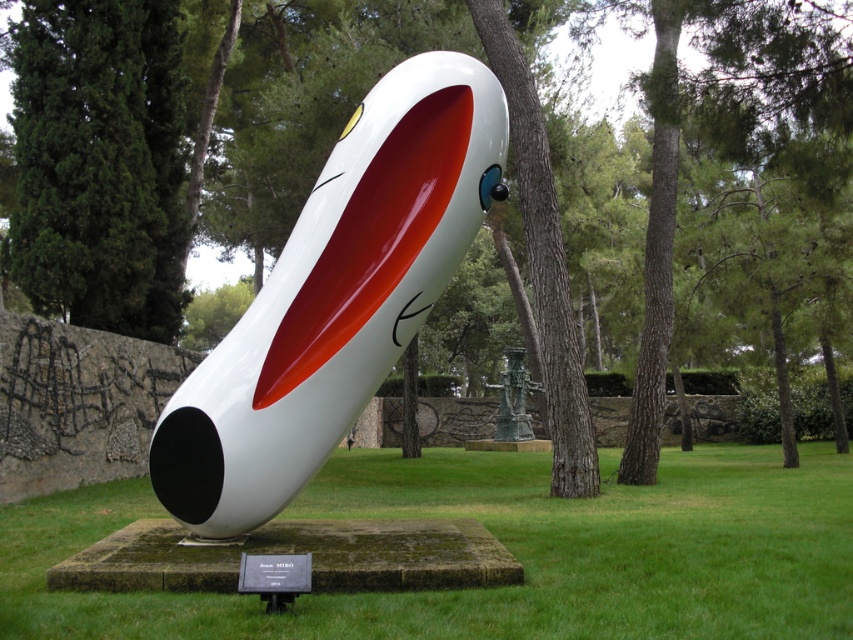
You are standing in the park and see the green grass at center and the green patinated metal statue at center. Which one is positioned to the left?

The green grass at center is to the left of the green patinated metal statue at center.

You are a visitor at the park and want to take a photo of both the white glossy rocket at center and the green patinated metal statue at center. Which one should you position to your left side to include both in the frame?

You should position the green patinated metal statue at center to your left side because the white glossy rocket at center is already to the left of it, ensuring both are included in the frame.

You are standing at the base of the sculpture and want to walk directly towards the green grass at center marked by point (506, 547). Is there any obstacle in your path between the sculpture and the green grass at center?

The point (506, 547) marks the green grass at center, so there is no obstacle between the sculpture and the green grass at center. You can walk directly towards it.